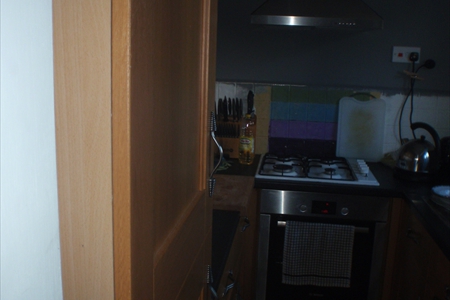
Find the location of a particular element. Image resolution: width=450 pixels, height=300 pixels. dirty cutting board is located at coordinates 365,129.